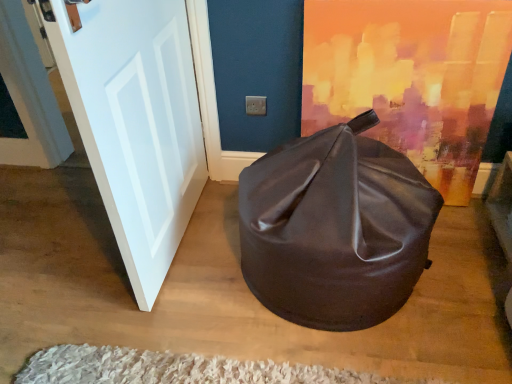
The height and width of the screenshot is (384, 512). What are the coordinates of `free space to the left of white glossy door at left` in the screenshot? It's located at (59, 246).